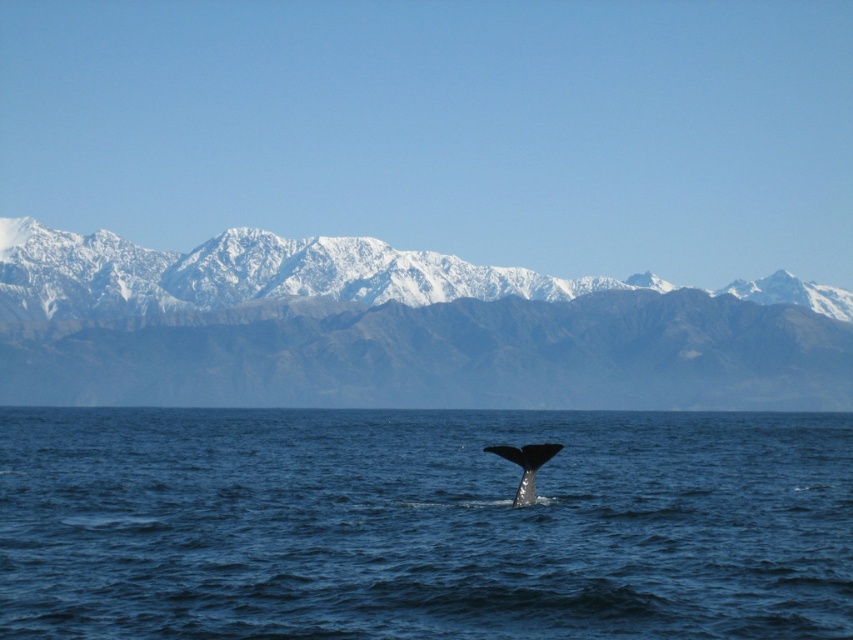
Between point (392, 100) and point (537, 445), which one is positioned behind?

The point (392, 100) is more distant.

Could you measure the distance between white snow-covered mountains at upper center and gray smooth whale tail at lower center?

white snow-covered mountains at upper center and gray smooth whale tail at lower center are 400.43 meters apart.

Image resolution: width=853 pixels, height=640 pixels. Describe the element at coordinates (444, 129) in the screenshot. I see `white snow-covered mountains at upper center` at that location.

Image resolution: width=853 pixels, height=640 pixels. What are the coordinates of `white snow-covered mountains at upper center` in the screenshot? It's located at tap(444, 129).

You are a GUI agent. You are given a task and a screenshot of the screen. Output one action in this format:
    pyautogui.click(x=<x>, y=<y>)
    Task: Click on the blue water at tail center
    
    Given the screenshot: What is the action you would take?
    pyautogui.click(x=422, y=524)

Can you confirm if blue water at tail center is positioned above snowy rock mountain range at upper center?

No, blue water at tail center is not above snowy rock mountain range at upper center.

Where is `blue water at tail center`? blue water at tail center is located at coordinates (422, 524).

The height and width of the screenshot is (640, 853). Identify the location of blue water at tail center. (422, 524).

Can you confirm if blue water at tail center is positioned to the left of gray smooth whale tail at lower center?

Incorrect, blue water at tail center is not on the left side of gray smooth whale tail at lower center.

Is blue water at tail center positioned at the back of gray smooth whale tail at lower center?

Yes, blue water at tail center is behind gray smooth whale tail at lower center.

Locate an element on the screen. This screenshot has width=853, height=640. blue water at tail center is located at coordinates (422, 524).